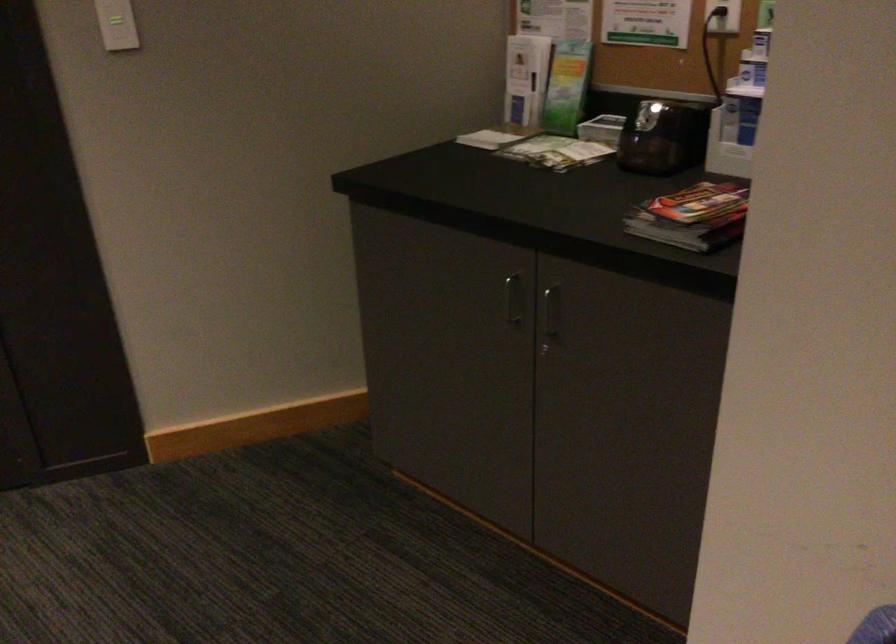
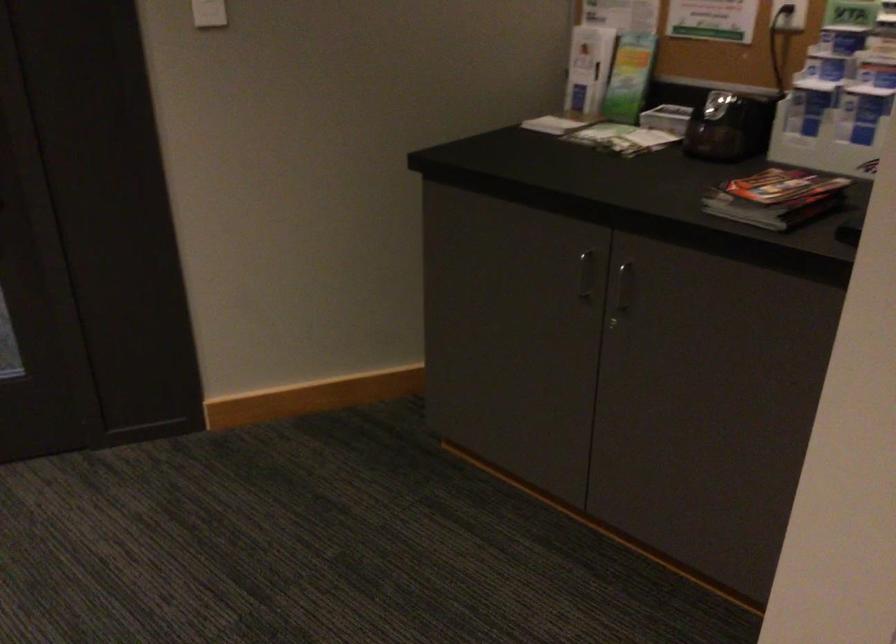
Question: Based on the continuous images, in which direction is the camera rotating? Reply with the corresponding letter.

Choices:
 (A) Left
 (B) Right
 (C) Up
 (D) Down

Answer: (B)